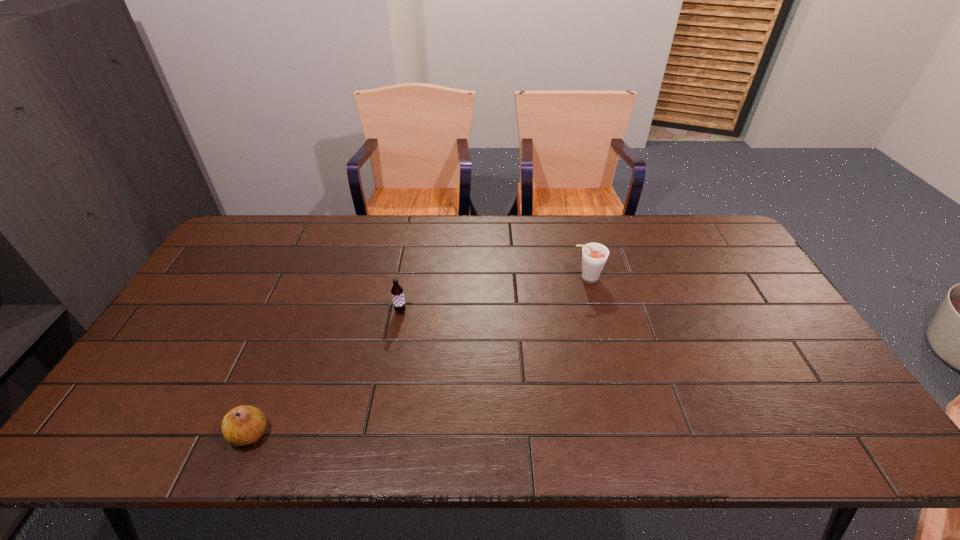
The image size is (960, 540). Identify the location of blank region between the nearest object and the right root beer. (418, 356).

Where is `empty space between the nearest object and the left root beer`? The image size is (960, 540). empty space between the nearest object and the left root beer is located at coordinates (325, 373).

The height and width of the screenshot is (540, 960). Identify the location of free spot between the farthest object and the pear. (418, 356).

The image size is (960, 540). I want to click on vacant space in between the leftmost object and the farther root beer, so click(x=418, y=356).

Identify the location of vacant point located between the leftmost object and the rightmost object. (418, 356).

You are a GUI agent. You are given a task and a screenshot of the screen. Output one action in this format:
    pyautogui.click(x=<x>, y=<y>)
    Task: Click on the vacant space in between the pear and the second farthest object
    Image resolution: width=960 pixels, height=540 pixels.
    Given the screenshot: What is the action you would take?
    pyautogui.click(x=325, y=373)

Identify the location of object that is the nearest to the nearest object. This screenshot has width=960, height=540. (397, 292).

Image resolution: width=960 pixels, height=540 pixels. I want to click on object that is the second closest to the farther root beer, so click(x=243, y=425).

The height and width of the screenshot is (540, 960). In order to click on vacant space that satisfies the following two spatial constraints: 1. on the back side of the second object from right to left; 2. on the right side of the leftmost object in this screenshot , I will do `click(300, 311)`.

Find the location of a particular element. This screenshot has height=540, width=960. vacant region that satisfies the following two spatial constraints: 1. on the back side of the left root beer; 2. on the left side of the leftmost object is located at coordinates (300, 311).